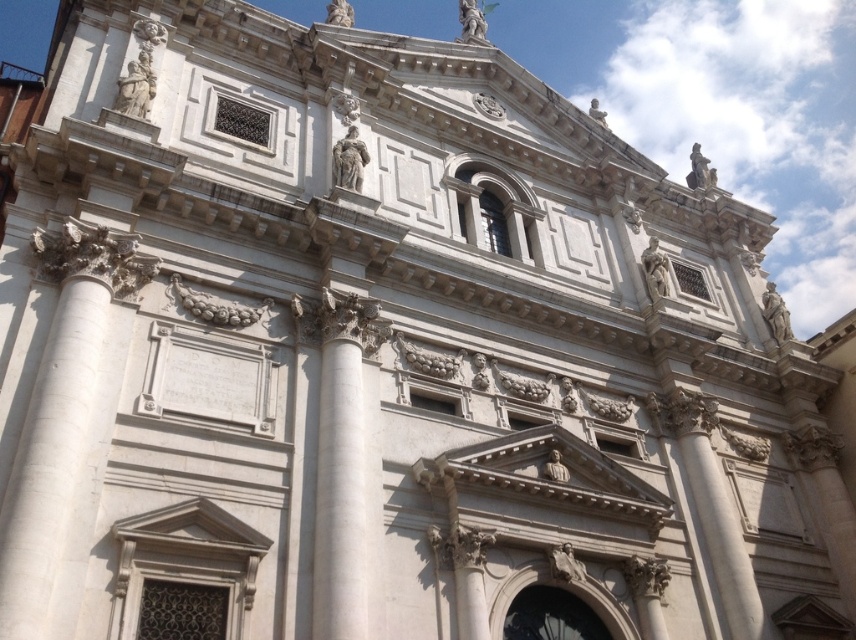
Question: Does white marble column at left have a greater width compared to white marble column at center?

Choices:
 (A) no
 (B) yes

Answer: (A)

Question: Is white marble column at left smaller than white marble column at center?

Choices:
 (A) yes
 (B) no

Answer: (B)

Question: Among these objects, which one is farthest from the camera?

Choices:
 (A) white marble column at center
 (B) white marble column at left

Answer: (A)

Question: Among these points, which one is nearest to the camera?

Choices:
 (A) (58, 449)
 (B) (364, 556)

Answer: (A)

Question: Can you confirm if white marble column at left is positioned to the right of white marble column at center?

Choices:
 (A) yes
 (B) no

Answer: (B)